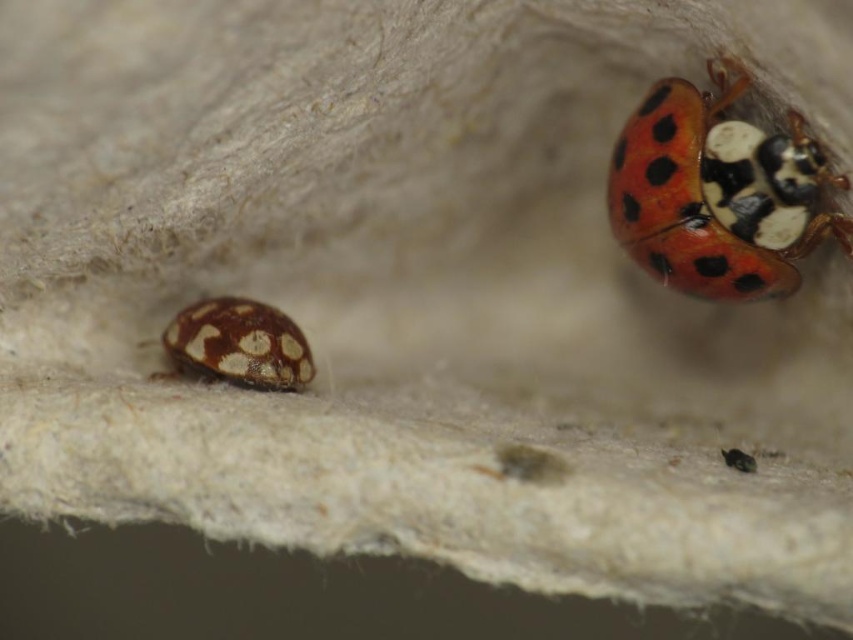
You are an entomologist examining two insects on a textured white surface. You see the matte brown ladybug at lower left and the shiny metallic bug at upper right. Which one has a greater height?

The matte brown ladybug at lower left is taller than the shiny metallic bug at upper right according to the description.

You are an entomologist observing two insects on a white fibrous surface. You notice a shiny red beetle at upper right and a shiny metallic bug at upper right. Which of these two insects is positioned more to the left?

The shiny red beetle at upper right is positioned to the left of the shiny metallic bug at upper right.

Based on the photo, you are a child trying to catch both the shiny red beetle at upper right and the shiny metallic bug at upper right. The distance between them is 10.80 inches. If your hand can cover 12 inches in one swipe, will you be able to catch both insects in one try?

The shiny red beetle at upper right and the shiny metallic bug at upper right are 10.80 inches apart from each other. Since your hand can cover 12 inches in one swipe, you can catch both insects in one try as the distance between them is less than the coverage of your hand.